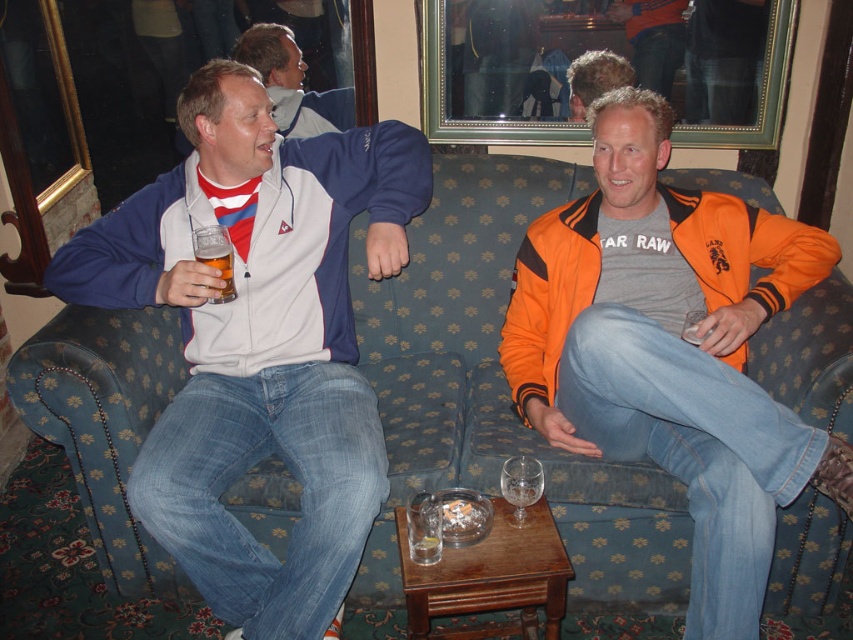
Who is more distant from viewer, (807, 349) or (425, 548)?

A: The point (807, 349) is more distant.

Does blue fabric couch at center have a greater width compared to translucent glass at center?

Yes, blue fabric couch at center is wider than translucent glass at center.

At what (x,y) coordinates should I click in order to perform the action: click on blue fabric couch at center. Please return your answer as a coordinate pair (x, y). This screenshot has height=640, width=853. Looking at the image, I should click on (495, 388).

Between blue fabric couch at center and matte blue jacket at left, which one has less height?

With less height is blue fabric couch at center.

Between blue fabric couch at center and matte blue jacket at left, which one is positioned lower?

blue fabric couch at center

Who is more forward, (651, 572) or (207, 550)?

Positioned in front is point (207, 550).

At what (x,y) coordinates should I click in order to perform the action: click on blue fabric couch at center. Please return your answer as a coordinate pair (x, y). The width and height of the screenshot is (853, 640). Looking at the image, I should click on (495, 388).

Is blue fabric couch at center below matte blue jacket at upper left?

Yes, blue fabric couch at center is below matte blue jacket at upper left.

Is point (728, 186) farther from viewer compared to point (254, 35)?

That is False.

I want to click on blue fabric couch at center, so click(495, 388).